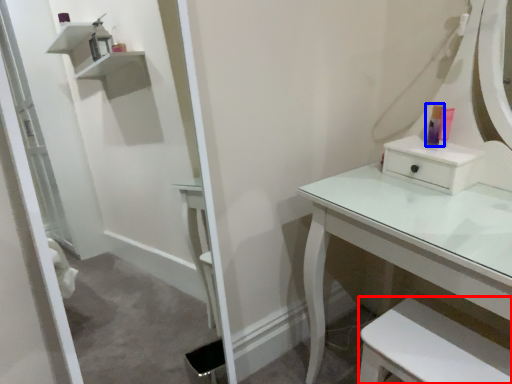
Question: Among these objects, which one is nearest to the camera, step stool (highlighted by a red box) or toiletry (highlighted by a blue box)?

Choices:
 (A) step stool
 (B) toiletry

Answer: (A)